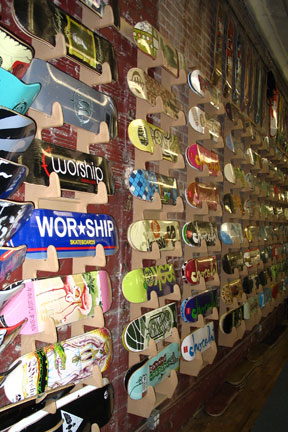
Identify the location of lower red wall. This screenshot has height=432, width=288. (202, 392), (229, 362), (265, 330).